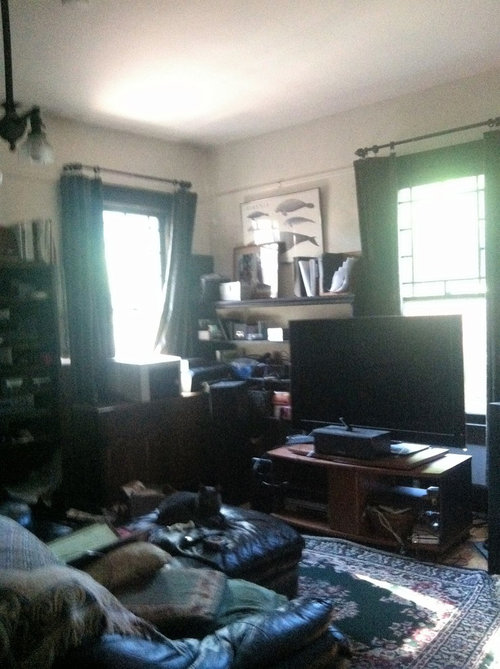
I want to click on flat screen tv, so click(396, 369).